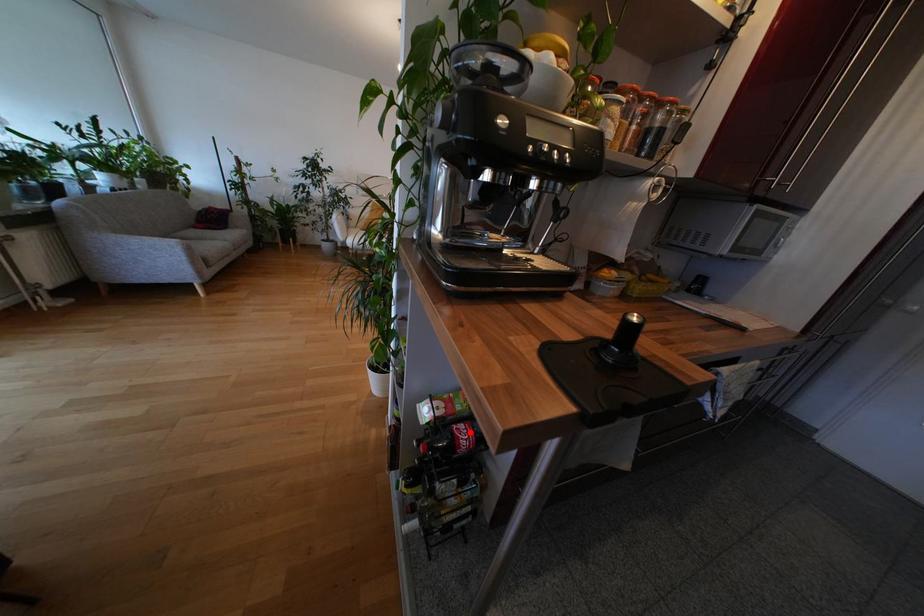
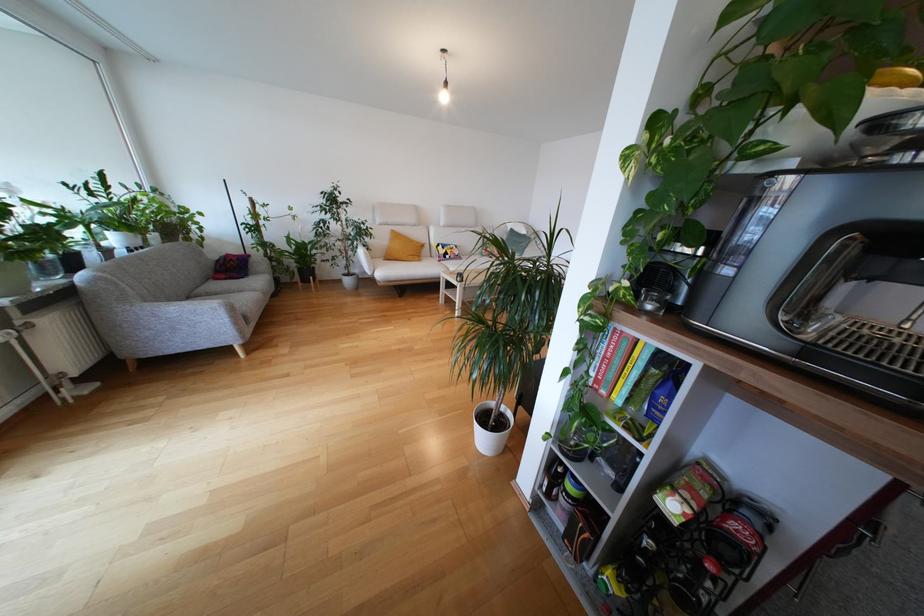
Locate, in the second image, the point that corresponds to the highlighted location in the first image.

(750, 533)